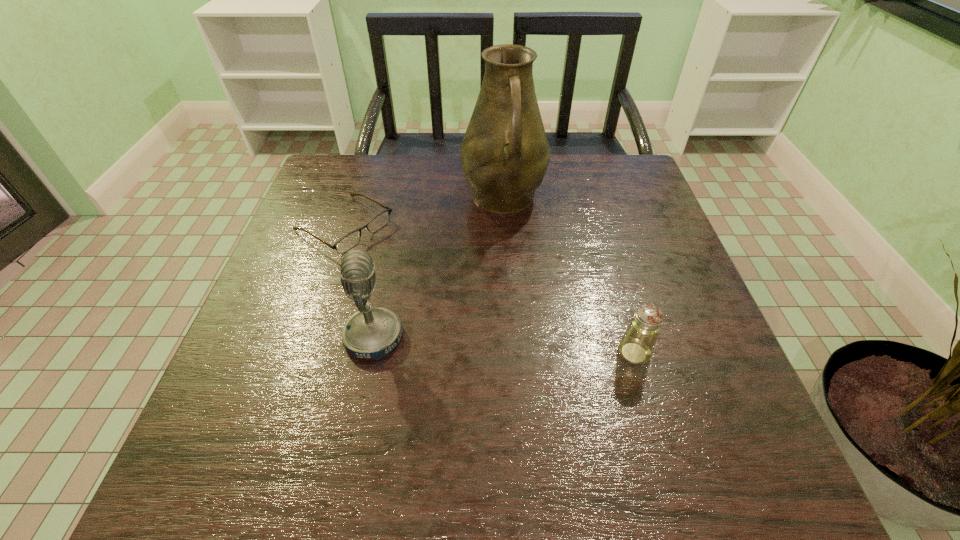
Locate an element on the screen. vacant space on the desktop that is between the second tallest object and the saltshaker and is positioned on the handle side of the tallest object is located at coordinates (536, 347).

This screenshot has height=540, width=960. I want to click on free space on the desktop that is between the second tallest object and the second shortest object and is positioned on the front-facing side of the shortest object, so click(540, 347).